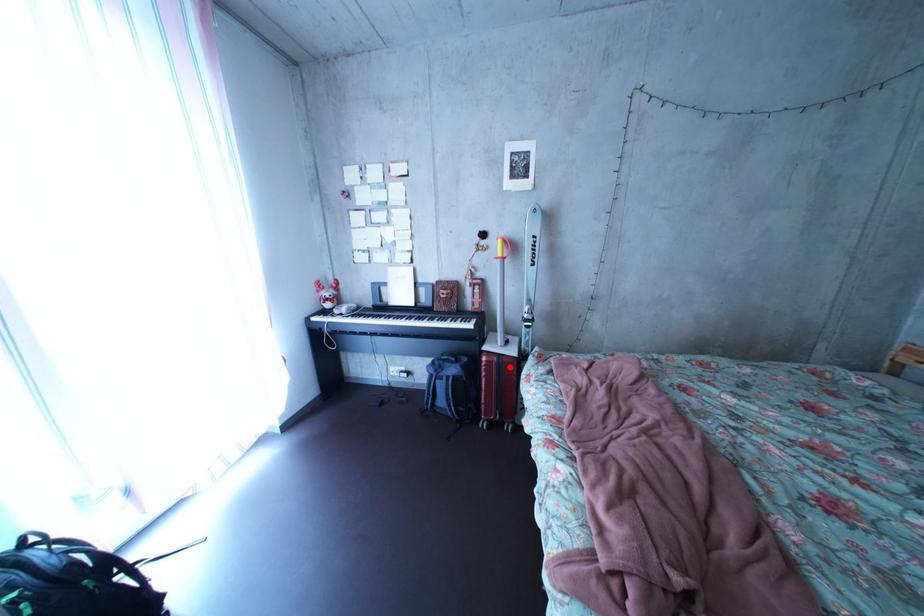
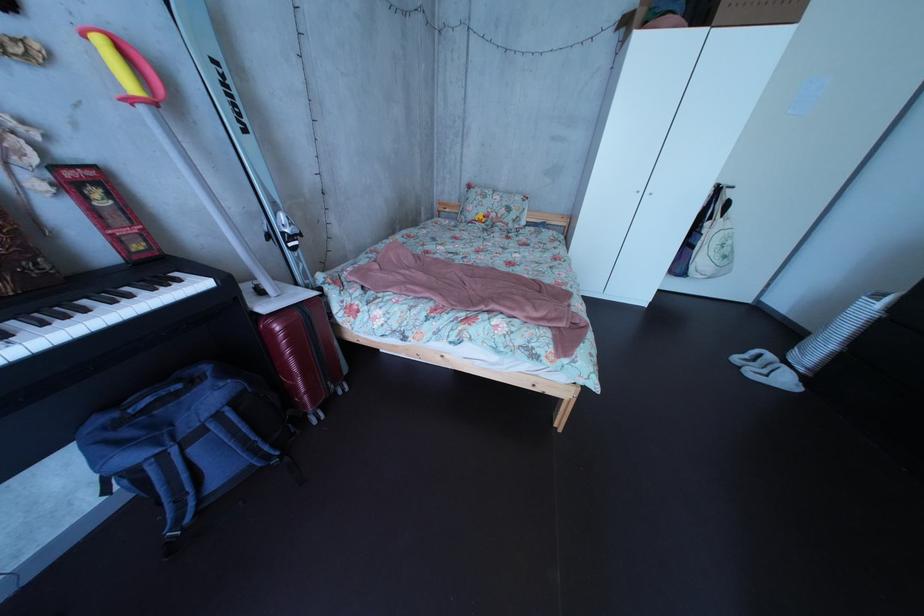
Question: A red point is marked in image1. In image2, is the corresponding 3D point closer to the camera or farther? Reply with the corresponding letter.

Choices:
 (A) The corresponding 3D point is closer.
 (B) The corresponding 3D point is farther.

Answer: (A)